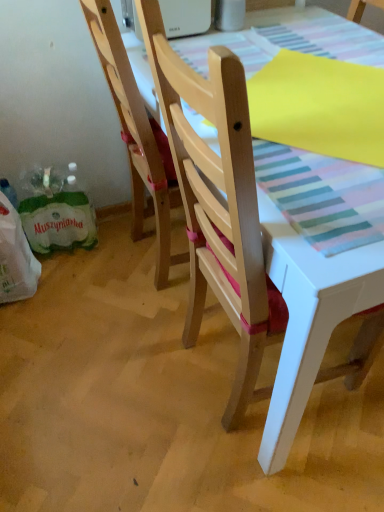
Question: From a real-world perspective, is green paper shopping bag at lower left above or below wooden chair at center, the second chair when ordered from left to right?

Choices:
 (A) below
 (B) above

Answer: (A)

Question: Based on their sizes in the image, would you say green paper shopping bag at lower left is bigger or smaller than wooden chair at center, the second chair when ordered from left to right?

Choices:
 (A) big
 (B) small

Answer: (B)

Question: Which object is the farthest from the natural wood chair at center, the 1th chair when ordered from left to right?

Choices:
 (A) green plastic grocery bag at lower left
 (B) green paper shopping bag at lower left
 (C) wooden chair at center, the second chair when ordered from left to right

Answer: (A)

Question: Considering the real-world distances, which object is closest to the natural wood chair at center, arranged as the second chair when viewed from the right?

Choices:
 (A) green paper shopping bag at lower left
 (B) green plastic grocery bag at lower left
 (C) wooden chair at center, acting as the first chair starting from the right

Answer: (A)